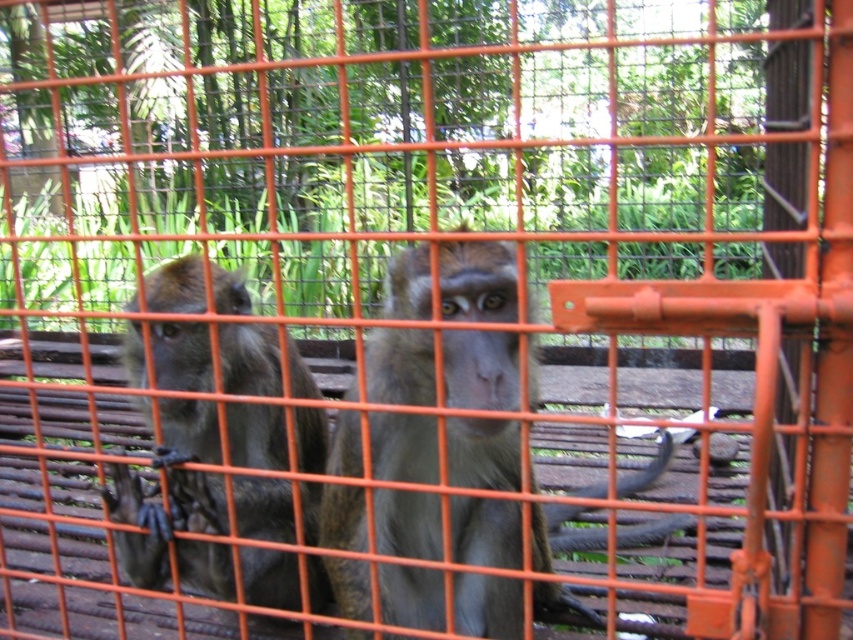
Question: Is gray fur monkey at center behind shiny brown fur at left?

Choices:
 (A) no
 (B) yes

Answer: (A)

Question: Can you confirm if gray fur monkey at center is bigger than shiny brown fur at left?

Choices:
 (A) yes
 (B) no

Answer: (A)

Question: In this image, where is gray fur monkey at center located relative to shiny brown fur at left?

Choices:
 (A) below
 (B) above

Answer: (B)

Question: Among these points, which one is farthest from the camera?

Choices:
 (A) (109, 506)
 (B) (511, 404)

Answer: (A)

Question: Which point is farther to the camera?

Choices:
 (A) (285, 572)
 (B) (517, 522)

Answer: (A)